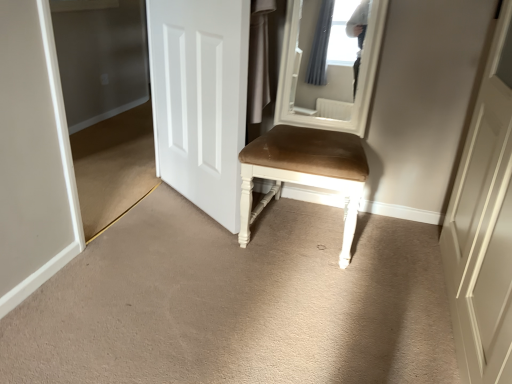
Where is `free spot in front of suede-like brown chair at center`? Image resolution: width=512 pixels, height=384 pixels. free spot in front of suede-like brown chair at center is located at coordinates (309, 293).